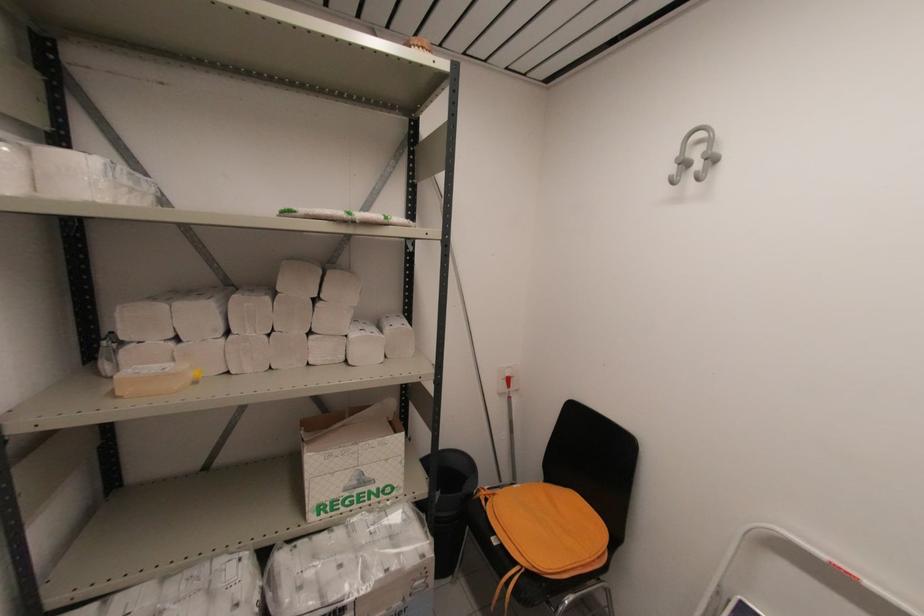
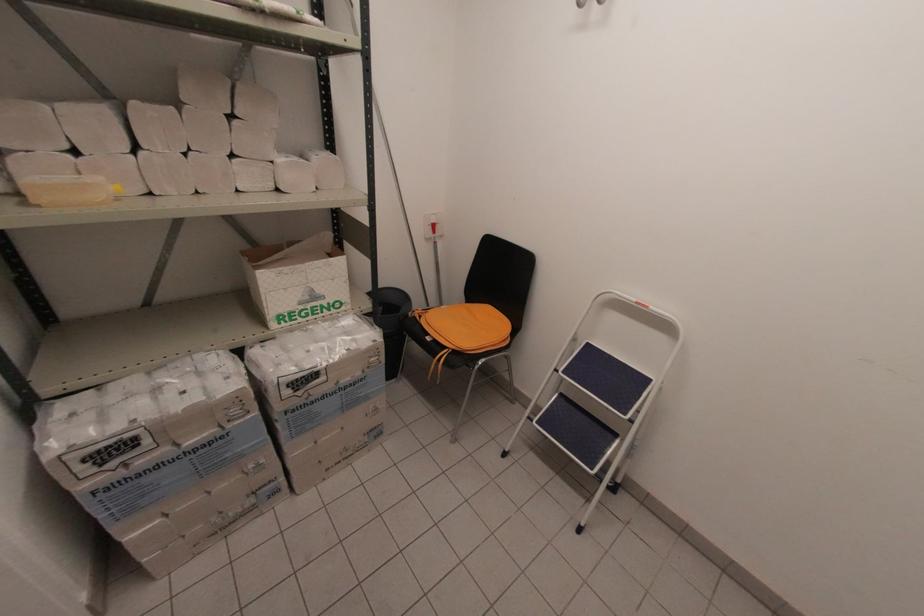
In the second image, find the point that corresponds to (599,530) in the first image.

(505, 325)